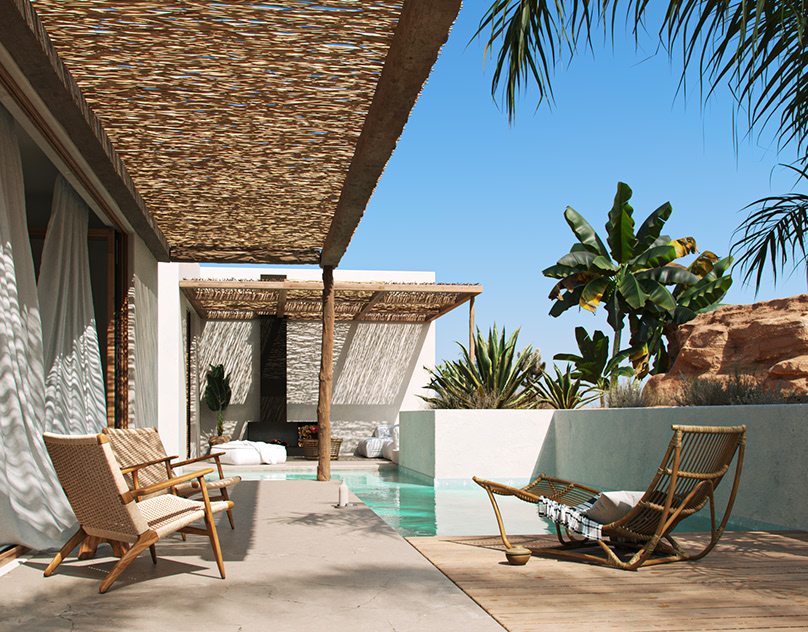
In order to click on chair to the right in this screenshot , I will do `click(692, 474)`.